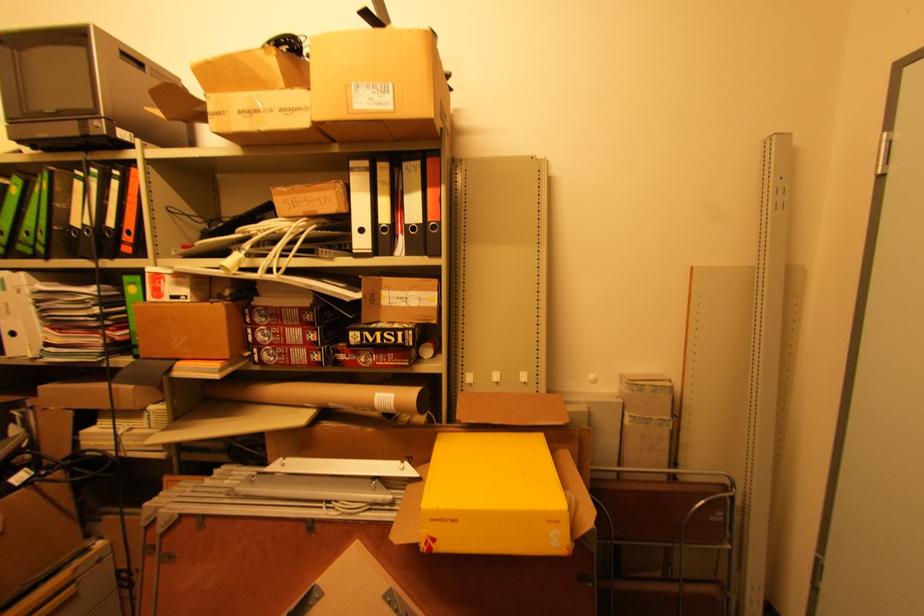
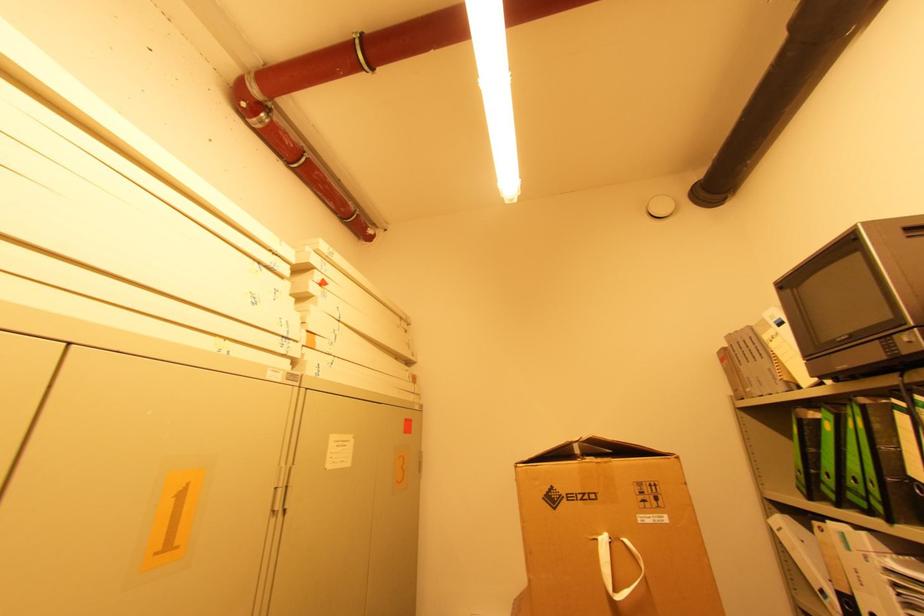
Where in the second image is the point corresponding to the point at 52,257 from the first image?

(894, 522)